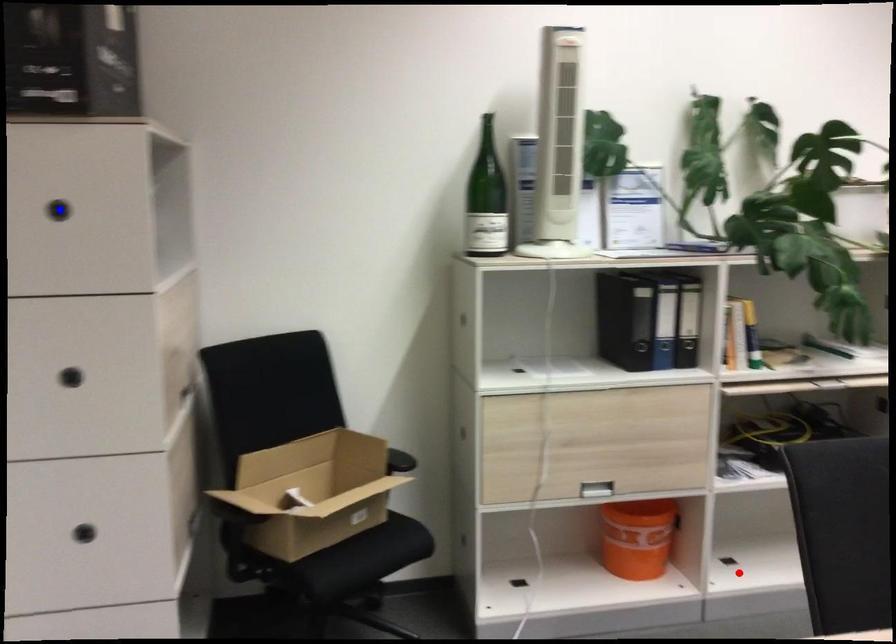
Question: Two points are marked on the image. Which point is closer to the camera?

Choices:
 (A) Blue point is closer.
 (B) Red point is closer.

Answer: (A)